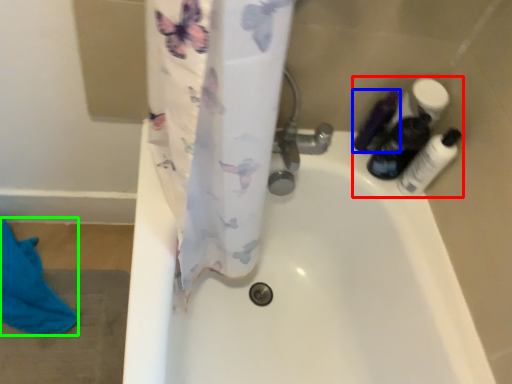
Question: Which object is the farthest from toiletry (highlighted by a red box)? Choose among these: toiletry (highlighted by a blue box) or beach towel (highlighted by a green box).

Choices:
 (A) toiletry
 (B) beach towel

Answer: (B)